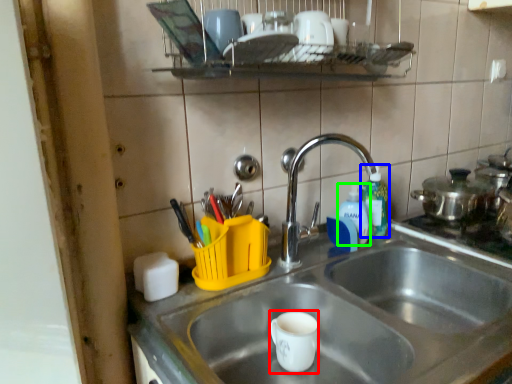
Question: Estimate the real-world distances between objects in this image. Which object is closer to mug (highlighted by a red box), bottle (highlighted by a blue box) or bottle (highlighted by a green box)?

Choices:
 (A) bottle
 (B) bottle

Answer: (B)